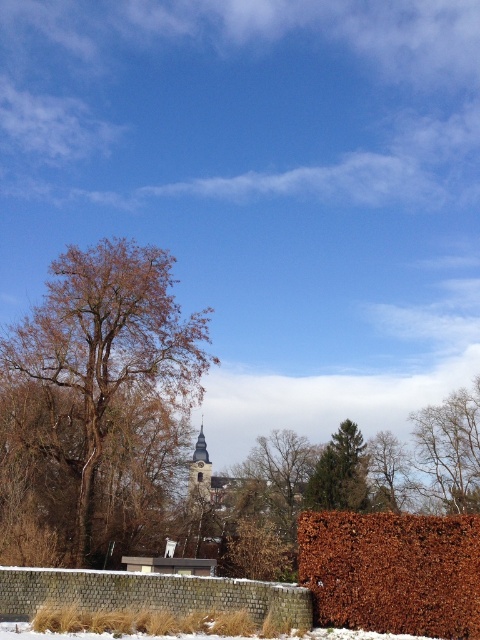
You are an arborist assessing a winter landscape. You notice the brown rough bark tree at left and the bare branches at center. Which of these two features is positioned higher in the scene?

The brown rough bark tree at left is positioned higher than the bare branches at center.

You are standing in the winter scene and want to reach a birdhouse located at point A. The birdhouse is directly behind the bare branches at upper right. Can you see the birdhouse from your current position?

The bare branches at upper right is located at point (450, 451), so yes, you can see the birdhouse behind it because the branches are at upper right and the birdhouse is directly behind them, but since the branches are part of the tree, they might block the view. Wait, the answer needs to be based on the description. The objects description only says location, not obstruction. Hmm, maybe the question is about visibility based on position? Let me recheck the rules. The answer must use the objects desc. The